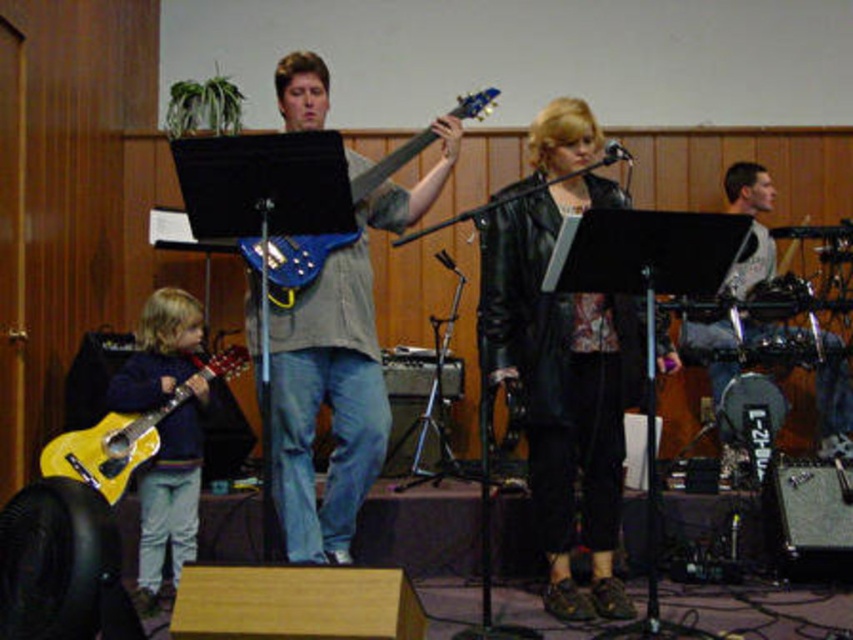
You are organizing a small concert and need to place a microphone stand between the black leather jacket at center and the yellow matte guitar at lower left. Considering their sizes, which object should the stand be closer to to ensure it doesn

The black leather jacket at center is wider than the yellow matte guitar at lower left. To accommodate the wider object, the microphone stand should be placed closer to the yellow matte guitar at lower left to maintain balance between the two.

You are a photographer setting up for a photo shoot in the described scene. You want to ensure that both the matte yellow guitar at left and the gray textured shirt at right are clearly visible in the frame. Based on their positions, which object is closer to the camera?

The matte yellow guitar at left is in front of the gray textured shirt at right, so it is closer to the camera.